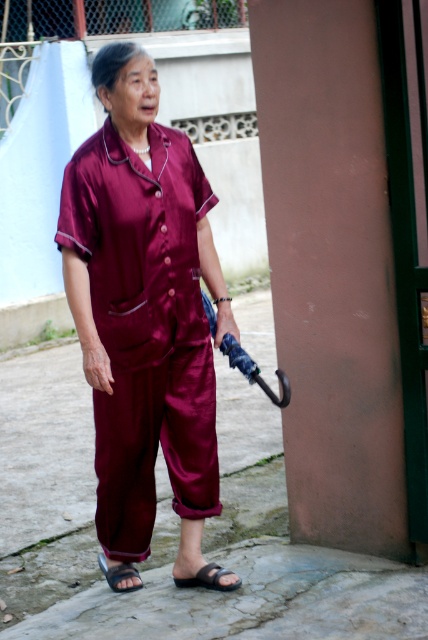
You are a fashion designer observing the elderly woman wearing the maroon satin pajamas at center and the black rubber sandal at lower center. You need to design a matching accessory that can be worn with both items. Considering their distance apart, can you suggest a belt that would fit comfortably between them?

The maroon satin pajamas at center and black rubber sandal at lower center are 38.43 inches apart, so a belt with a length of 38 inches would fit comfortably between them, ensuring it complements both the pajamas and the sandal.

What are the coordinates of the maroon satin pajamas at center in the image?

The maroon satin pajamas at center are located at coordinates point (143, 310).

You are a photographer setting up a shoot and need to focus on the black rubber sandal at lower center and the black leather sandal at lower center. Which sandal should you adjust your camera focus to first to ensure it appears sharp in the photo?

You should focus on the black rubber sandal at lower center first because it is closer to the viewer than the black leather sandal at lower center, so adjusting focus starting from the closer object ensures proper depth of field.